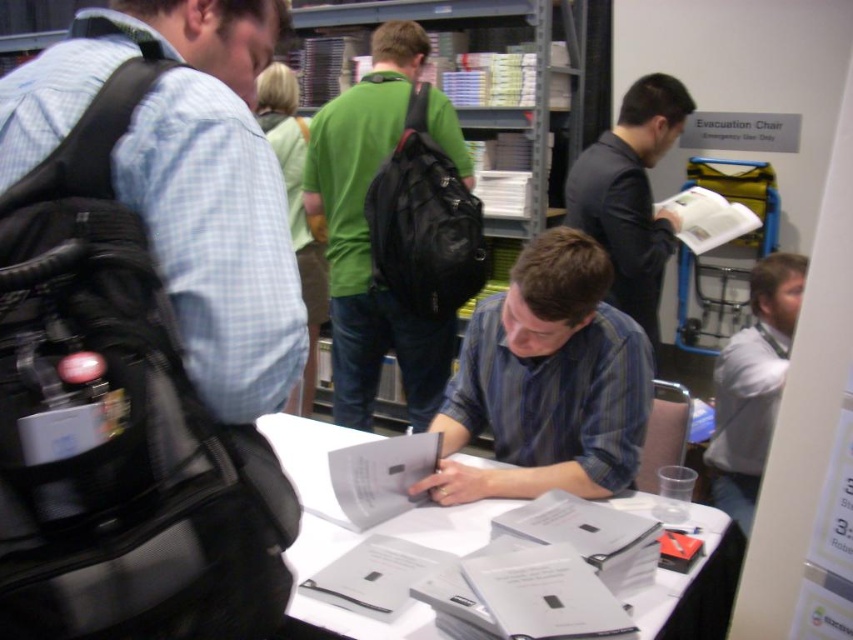
Can you confirm if dark gray suit jacket at upper right is bigger than white shirt at right?

Indeed, dark gray suit jacket at upper right has a larger size compared to white shirt at right.

Who is positioned more to the left, dark gray suit jacket at upper right or white shirt at right?

Positioned to the left is dark gray suit jacket at upper right.

Where is `dark gray suit jacket at upper right`? The image size is (853, 640). dark gray suit jacket at upper right is located at coordinates (630, 195).

Image resolution: width=853 pixels, height=640 pixels. Identify the location of dark gray suit jacket at upper right. (630, 195).

Looking at this image, does blue striped shirt at center appear on the left side of green matte backpack at center?

No, blue striped shirt at center is not to the left of green matte backpack at center.

Is blue striped shirt at center shorter than green matte backpack at center?

Indeed, blue striped shirt at center has a lesser height compared to green matte backpack at center.

Image resolution: width=853 pixels, height=640 pixels. What do you see at coordinates (547, 381) in the screenshot?
I see `blue striped shirt at center` at bounding box center [547, 381].

Where is `blue striped shirt at center`? This screenshot has height=640, width=853. blue striped shirt at center is located at coordinates [x=547, y=381].

This screenshot has height=640, width=853. What do you see at coordinates (752, 385) in the screenshot? I see `white shirt at right` at bounding box center [752, 385].

Which of these two, white shirt at right or white paper at center, stands taller?

white shirt at right is taller.

Who is more distant from viewer, (756,278) or (265,426)?

Point (756,278)

You are a GUI agent. You are given a task and a screenshot of the screen. Output one action in this format:
    pyautogui.click(x=<x>, y=<y>)
    Task: Click on the white shirt at right
    The height and width of the screenshot is (640, 853).
    Given the screenshot: What is the action you would take?
    pyautogui.click(x=752, y=385)